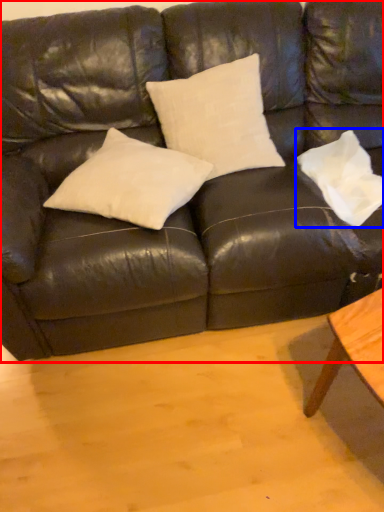
Question: Which point is closer to the camera, studio couch (highlighted by a red box) or pillow (highlighted by a blue box)?

Choices:
 (A) studio couch
 (B) pillow

Answer: (A)